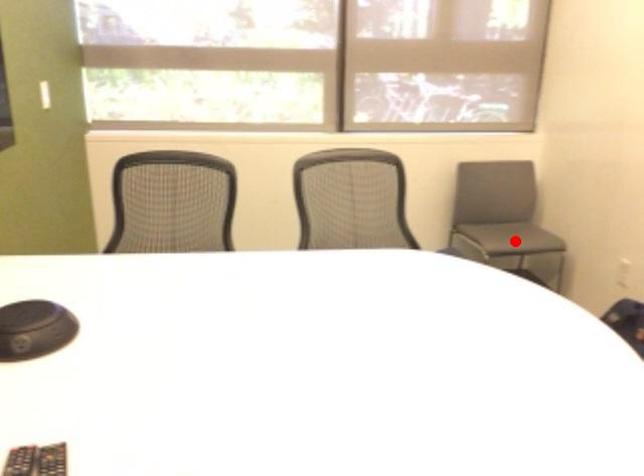
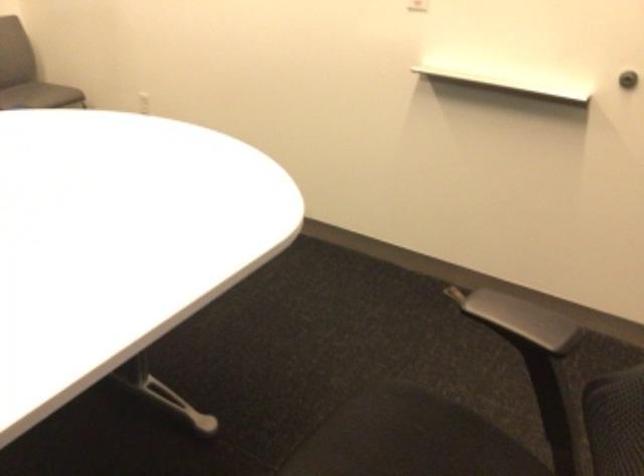
Find the pixel in the second image that matches the highlighted location in the first image.

(39, 95)